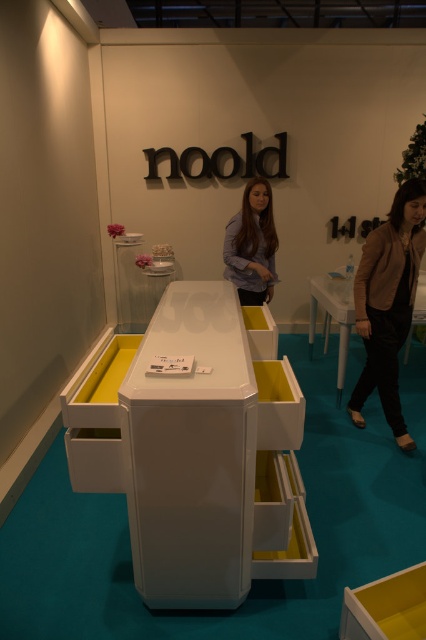
You are a GUI agent. You are given a task and a screenshot of the screen. Output one action in this format:
    pyautogui.click(x=<x>, y=<y>)
    Task: Click on the black leather jacket at right
    The image size is (426, 640).
    Given the screenshot: What is the action you would take?
    pyautogui.click(x=388, y=304)

Image resolution: width=426 pixels, height=640 pixels. I want to click on black leather jacket at right, so click(388, 304).

Identify the location of black leather jacket at right. This screenshot has height=640, width=426. (388, 304).

Can you confirm if black leather jacket at right is thinner than white glossy table at center?

Incorrect, black leather jacket at right's width is not less than white glossy table at center's.

What do you see at coordinates (388, 304) in the screenshot?
I see `black leather jacket at right` at bounding box center [388, 304].

I want to click on black leather jacket at right, so click(388, 304).

Is point (267, 196) behind point (344, 339)?

No, (267, 196) is closer to viewer.

Which is in front, point (253, 259) or point (405, 358)?

Point (253, 259) is in front.

Find the location of `matte blue shirt at center`. matte blue shirt at center is located at coordinates (252, 244).